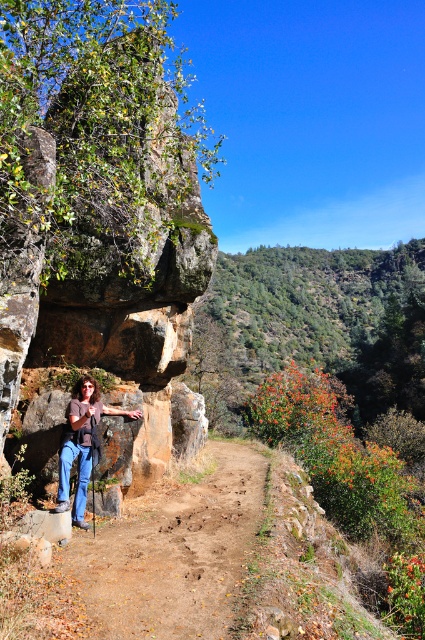
Who is shorter, dirt path at center or matte brown shirt at center?

dirt path at center

Who is taller, dirt path at center or matte brown shirt at center?

matte brown shirt at center is taller.

Describe the element at coordinates (172, 554) in the screenshot. I see `dirt path at center` at that location.

The image size is (425, 640). Identify the location of dirt path at center. (172, 554).

Who is positioned more to the right, brown rough rock at left or dirt path at center?

dirt path at center is more to the right.

Who is shorter, brown rough rock at left or dirt path at center?

With less height is dirt path at center.

Is point (2, 436) positioned in front of point (215, 605)?

No, (2, 436) is behind (215, 605).

The width and height of the screenshot is (425, 640). Find the location of `brown rough rock at left`. brown rough rock at left is located at coordinates (104, 220).

Does brown rough rock at left have a lesser height compared to matte brown shirt at center?

No, brown rough rock at left is not shorter than matte brown shirt at center.

Is point (197, 195) closer to camera compared to point (78, 404)?

No, it is behind (78, 404).

What do you see at coordinates (104, 220) in the screenshot? The width and height of the screenshot is (425, 640). I see `brown rough rock at left` at bounding box center [104, 220].

Where is `brown rough rock at left`? The width and height of the screenshot is (425, 640). brown rough rock at left is located at coordinates (104, 220).